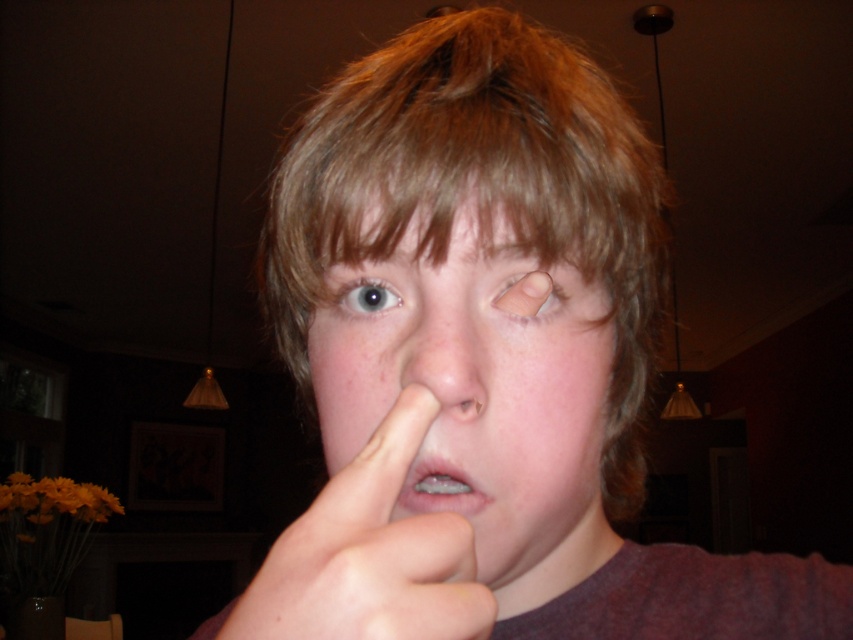
Between point (463, 486) and point (514, 291), which one is positioned behind?

Positioned behind is point (463, 486).

Which is more to the left, clear plastic braces at center or matte skin at center?

clear plastic braces at center

You are a GUI agent. You are given a task and a screenshot of the screen. Output one action in this format:
    pyautogui.click(x=<x>, y=<y>)
    Task: Click on the clear plastic braces at center
    The image size is (853, 640).
    Given the screenshot: What is the action you would take?
    pyautogui.click(x=439, y=488)

I want to click on clear plastic braces at center, so click(439, 488).

Looking at this image, does light brown hair at center appear under brown matte eyebrow at upper center?

Indeed, light brown hair at center is positioned under brown matte eyebrow at upper center.

Can you confirm if light brown hair at center is bigger than brown matte eyebrow at upper center?

Yes, light brown hair at center is bigger than brown matte eyebrow at upper center.

Is point (346, 122) more distant than point (485, 244)?

Yes, point (346, 122) is behind point (485, 244).

Find the location of a particular element. The image size is (853, 640). light brown hair at center is located at coordinates (476, 189).

Which of these two, matte skin at center or blue glossy eye at center, stands shorter?

blue glossy eye at center is shorter.

Is point (498, 305) farther from camera compared to point (344, 300)?

That is False.

You are a GUI agent. You are given a task and a screenshot of the screen. Output one action in this format:
    pyautogui.click(x=<x>, y=<y>)
    Task: Click on the matte skin at center
    
    Given the screenshot: What is the action you would take?
    pyautogui.click(x=526, y=294)

Identify the location of matte skin at center. The image size is (853, 640). (526, 294).